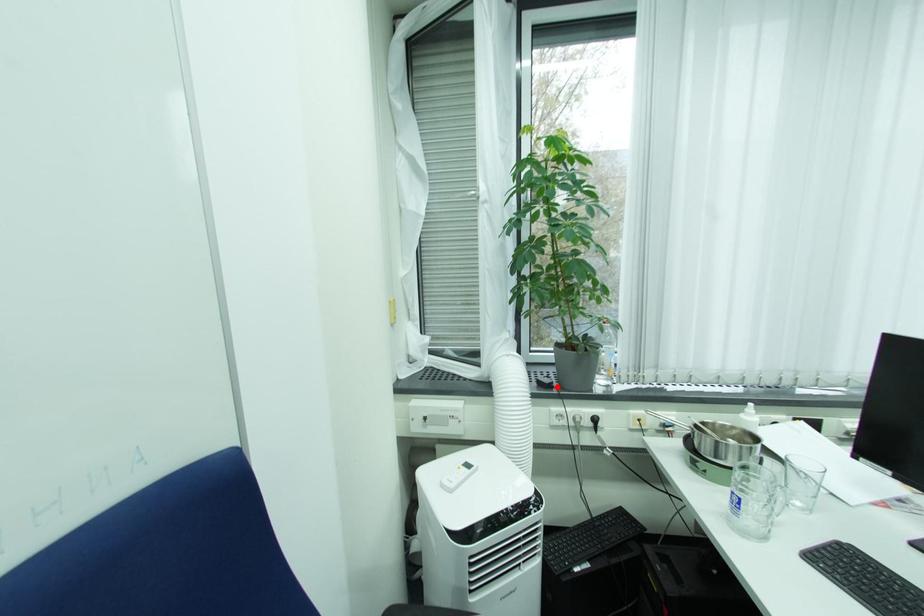
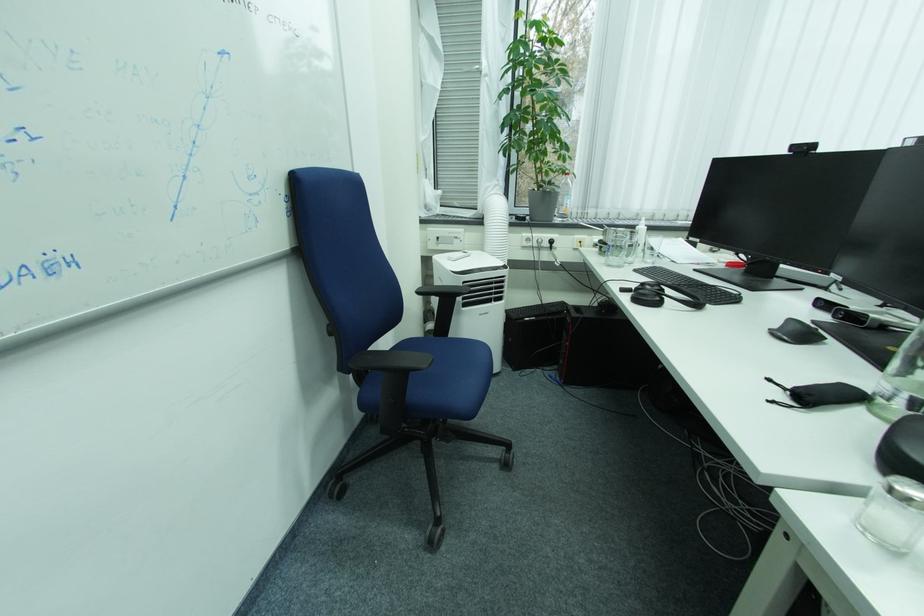
Where in the second image is the point corresponding to the highlighted location from the first image?

(530, 220)